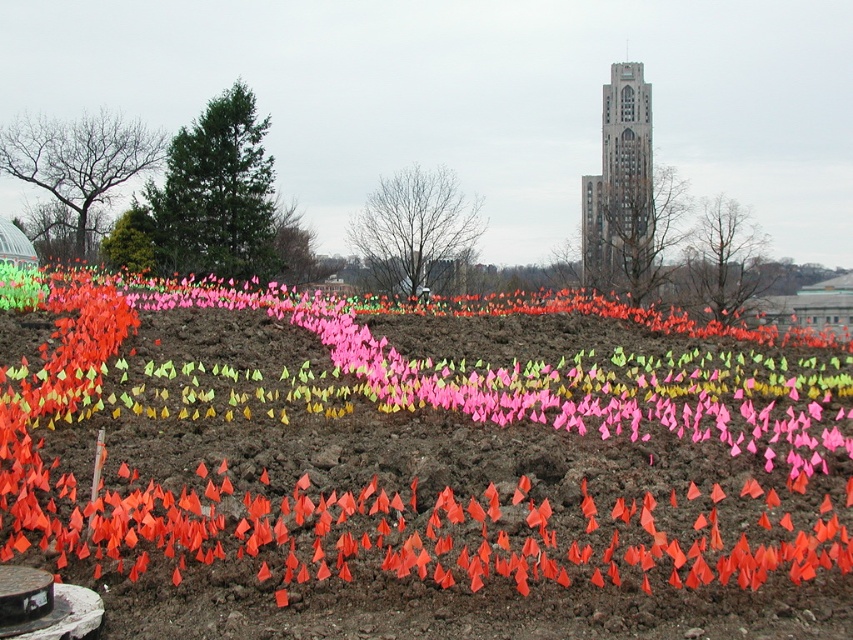
Question: Does orange paper flags at lower left have a greater width compared to gray stone bell tower at upper center?

Choices:
 (A) no
 (B) yes

Answer: (B)

Question: Can you confirm if orange paper flags at lower left is smaller than gray stone bell tower at upper center?

Choices:
 (A) no
 (B) yes

Answer: (B)

Question: Does orange paper flags at lower left have a smaller size compared to gray stone bell tower at upper center?

Choices:
 (A) yes
 (B) no

Answer: (A)